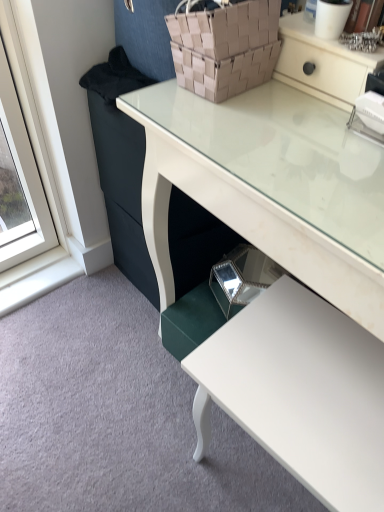
Question: From the image's perspective, does white glossy table at lower right appear higher than brown woven basket at upper center?

Choices:
 (A) yes
 (B) no

Answer: (B)

Question: Does white glossy table at lower right appear on the right side of brown woven basket at upper center?

Choices:
 (A) yes
 (B) no

Answer: (A)

Question: From the image's perspective, does white glossy table at lower right appear lower than brown woven basket at upper center?

Choices:
 (A) no
 (B) yes

Answer: (B)

Question: Does white glossy table at lower right have a smaller size compared to brown woven basket at upper center?

Choices:
 (A) yes
 (B) no

Answer: (B)

Question: Considering the relative sizes of white glossy table at lower right and brown woven basket at upper center in the image provided, is white glossy table at lower right bigger than brown woven basket at upper center?

Choices:
 (A) yes
 (B) no

Answer: (A)

Question: Is white glossy table at lower right not close to brown woven basket at upper center?

Choices:
 (A) yes
 (B) no

Answer: (B)

Question: From a real-world perspective, is white glossy desk at center located beneath white glossy table at lower right?

Choices:
 (A) yes
 (B) no

Answer: (B)

Question: Considering the relative sizes of white glossy desk at center and white glossy table at lower right in the image provided, is white glossy desk at center thinner than white glossy table at lower right?

Choices:
 (A) no
 (B) yes

Answer: (A)

Question: From a real-world perspective, is white glossy desk at center positioned over white glossy table at lower right based on gravity?

Choices:
 (A) yes
 (B) no

Answer: (A)

Question: Is white glossy desk at center shorter than white glossy table at lower right?

Choices:
 (A) yes
 (B) no

Answer: (B)

Question: Is white glossy desk at center looking in the opposite direction of white glossy table at lower right?

Choices:
 (A) yes
 (B) no

Answer: (B)

Question: Does white glossy desk at center have a smaller size compared to white glossy table at lower right?

Choices:
 (A) yes
 (B) no

Answer: (B)

Question: Is brown woven basket at upper center in contact with white glossy desk at center?

Choices:
 (A) no
 (B) yes

Answer: (A)